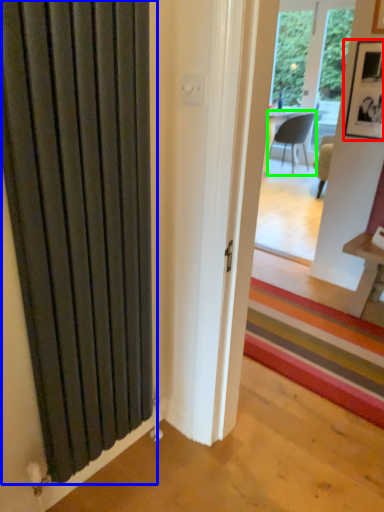
Question: Based on their relative distances, which object is farther from picture frame (highlighted by a red box)? Choose from door (highlighted by a blue box) and chair (highlighted by a green box).

Choices:
 (A) door
 (B) chair

Answer: (B)